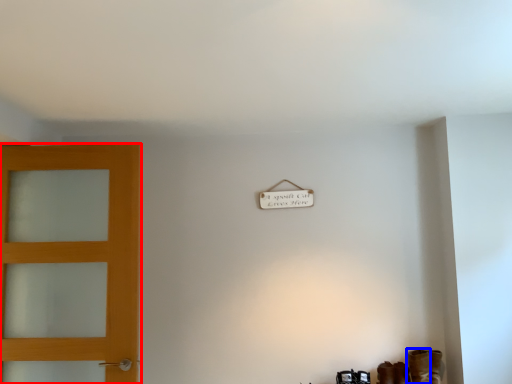
Question: Which object appears farthest to the camera in this image, door (highlighted by a red box) or boot (highlighted by a blue box)?

Choices:
 (A) door
 (B) boot

Answer: (B)